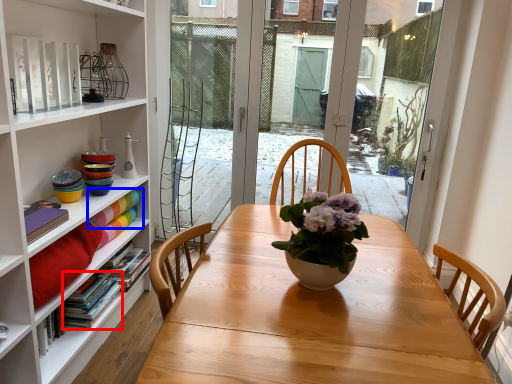
Question: Which object is closer to the camera taking this photo, book (highlighted by a red box) or book (highlighted by a blue box)?

Choices:
 (A) book
 (B) book

Answer: (A)